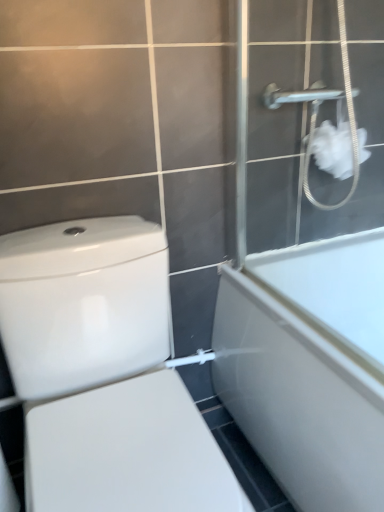
Question: Is white matte shower screen at upper right to the left or to the right of white fluffy tissue at upper right in the image?

Choices:
 (A) left
 (B) right

Answer: (B)

Question: From the image's perspective, relative to white fluffy tissue at upper right, is white matte shower screen at upper right above or below?

Choices:
 (A) below
 (B) above

Answer: (B)

Question: Which object is the closest to the white glossy bathtub at right?

Choices:
 (A) white matte shower screen at upper right
 (B) white fluffy tissue at upper right
 (C) white glossy toilet at lower left

Answer: (A)

Question: Which object is positioned closest to the white glossy toilet at lower left?

Choices:
 (A) white fluffy tissue at upper right
 (B) white glossy bathtub at right
 (C) white matte shower screen at upper right

Answer: (B)